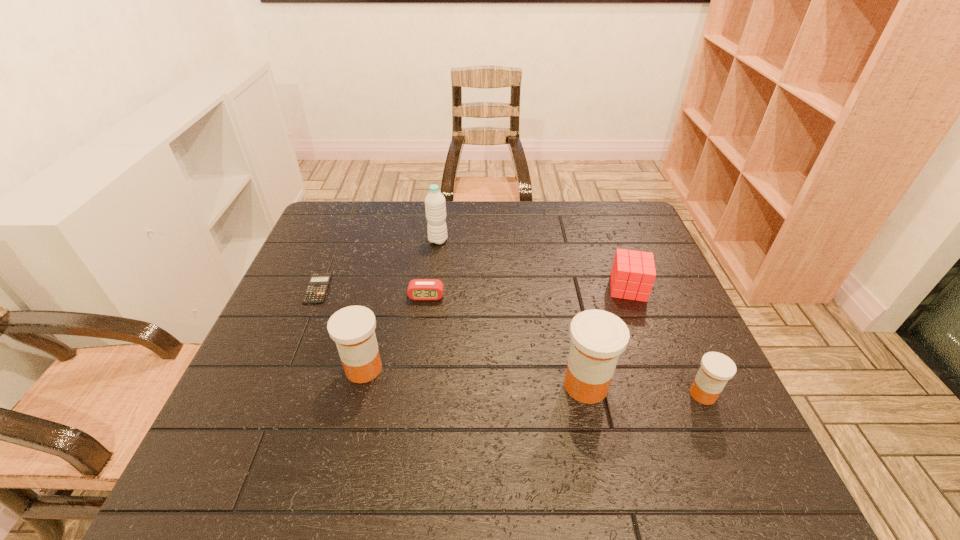
Please point a space for a new medicine to maintain equal intervals. Please provide its 2D coordinates. Your answer should be formatted as a tuple, i.e. [(x, y)], where the tuple contains the x and y coordinates of a point satisfying the conditions above.

[(473, 377)]